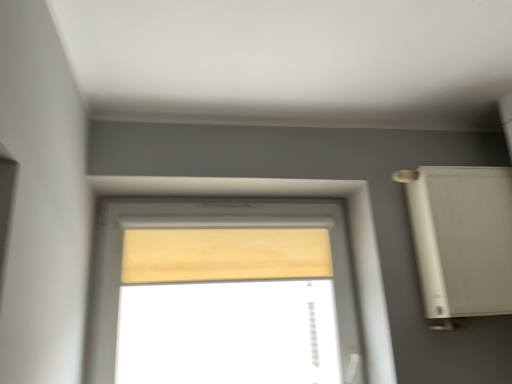
What do you see at coordinates (223, 293) in the screenshot? Image resolution: width=512 pixels, height=384 pixels. I see `wooden blind at center` at bounding box center [223, 293].

This screenshot has height=384, width=512. Describe the element at coordinates (224, 255) in the screenshot. I see `beige fabric curtain at center` at that location.

What do you see at coordinates (462, 238) in the screenshot? The width and height of the screenshot is (512, 384). I see `white plastic air conditioner at right` at bounding box center [462, 238].

In order to click on wooden blind at center in this screenshot , I will do `click(223, 293)`.

In the scene shown: In terms of width, does beige fabric curtain at center look wider or thinner when compared to white plastic air conditioner at right?

beige fabric curtain at center is thinner than white plastic air conditioner at right.

Is white plastic air conditioner at right a part of beige fabric curtain at center?

No, white plastic air conditioner at right is not surrounded by beige fabric curtain at center.

This screenshot has width=512, height=384. I want to click on air conditioner lying in front of the beige fabric curtain at center, so click(462, 238).

Is beige fabric curtain at center aimed at white plastic air conditioner at right?

No, beige fabric curtain at center is not aimed at white plastic air conditioner at right.

Can we say beige fabric curtain at center lies outside wooden blind at center?

No, beige fabric curtain at center is not outside of wooden blind at center.

Where is `window lying below the beige fabric curtain at center (from the image's perspective)`? This screenshot has height=384, width=512. window lying below the beige fabric curtain at center (from the image's perspective) is located at coordinates (223, 293).

Between beige fabric curtain at center and wooden blind at center, which one has more height?

Standing taller between the two is wooden blind at center.

Is beige fabric curtain at center thinner than wooden blind at center?

Indeed, beige fabric curtain at center has a lesser width compared to wooden blind at center.

Considering the sizes of wooden blind at center and white plastic air conditioner at right in the image, is wooden blind at center taller or shorter than white plastic air conditioner at right?

In the image, wooden blind at center appears to be taller than white plastic air conditioner at right.

How far apart are wooden blind at center and white plastic air conditioner at right?

wooden blind at center and white plastic air conditioner at right are 30.73 inches apart.

From a real-world perspective, who is located higher, wooden blind at center or white plastic air conditioner at right?

white plastic air conditioner at right is physically above.

Is wooden blind at center next to white plastic air conditioner at right?

No, wooden blind at center is not next to white plastic air conditioner at right.

Is white plastic air conditioner at right aimed at wooden blind at center?

No.

From a real-world perspective, relative to wooden blind at center, is white plastic air conditioner at right vertically above or below?

white plastic air conditioner at right is above wooden blind at center.

Is wooden blind at center located within white plastic air conditioner at right?

No, wooden blind at center is located outside of white plastic air conditioner at right.

Is white plastic air conditioner at right not near wooden blind at center?

white plastic air conditioner at right is near wooden blind at center, not far away.

Considering the points (426, 235) and (189, 248), which point is behind, point (426, 235) or point (189, 248)?

The point (189, 248) is farther from the camera.

Who is bigger, white plastic air conditioner at right or beige fabric curtain at center?

Bigger between the two is white plastic air conditioner at right.

Does white plastic air conditioner at right come in front of beige fabric curtain at center?

Yes, it is in front of beige fabric curtain at center.

Is wooden blind at center looking in the opposite direction of beige fabric curtain at center?

Yes, wooden blind at center is positioned with its back facing beige fabric curtain at center.

Is wooden blind at center not close to beige fabric curtain at center?

No, there isn't a large distance between wooden blind at center and beige fabric curtain at center.

Where is `curtain behind the wooden blind at center`? curtain behind the wooden blind at center is located at coordinates (224, 255).

Does wooden blind at center have a greater width compared to beige fabric curtain at center?

Yes.

At what (x,y) coordinates should I click in order to perform the action: click on air conditioner above the beige fabric curtain at center (from the image's perspective). Please return your answer as a coordinate pair (x, y). The width and height of the screenshot is (512, 384). Looking at the image, I should click on (462, 238).

Where is `curtain above the wooden blind at center (from a real-world perspective)`? The width and height of the screenshot is (512, 384). curtain above the wooden blind at center (from a real-world perspective) is located at coordinates 224,255.

Estimate the real-world distances between objects in this image. Which object is further from wooden blind at center, beige fabric curtain at center or white plastic air conditioner at right?

white plastic air conditioner at right is positioned further to the anchor wooden blind at center.

From the image, which object appears to be farther from white plastic air conditioner at right, wooden blind at center or beige fabric curtain at center?

wooden blind at center.

From the image, which object appears to be farther from beige fabric curtain at center, wooden blind at center or white plastic air conditioner at right?

white plastic air conditioner at right is further to beige fabric curtain at center.

Which object lies further to the anchor point white plastic air conditioner at right, beige fabric curtain at center or wooden blind at center?

wooden blind at center is positioned further to the anchor white plastic air conditioner at right.

From the image, which object appears to be farther from wooden blind at center, white plastic air conditioner at right or beige fabric curtain at center?

Among the two, white plastic air conditioner at right is located further to wooden blind at center.

Which object lies nearer to the anchor point beige fabric curtain at center, white plastic air conditioner at right or wooden blind at center?

The object closer to beige fabric curtain at center is wooden blind at center.

At what (x,y) coordinates should I click in order to perform the action: click on window between beige fabric curtain at center and white plastic air conditioner at right in the horizontal direction. Please return your answer as a coordinate pair (x, y). Looking at the image, I should click on point(223,293).